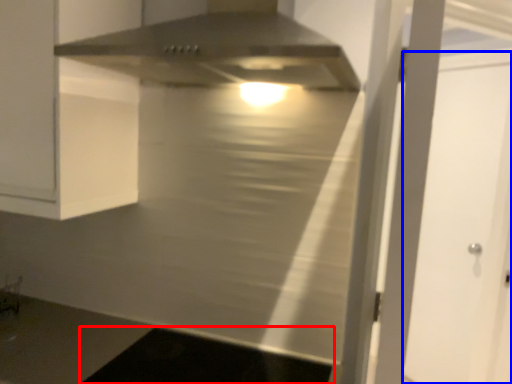
Question: Which object appears farthest to the camera in this image, dark (highlighted by a red box) or glass door (highlighted by a blue box)?

Choices:
 (A) dark
 (B) glass door

Answer: (B)